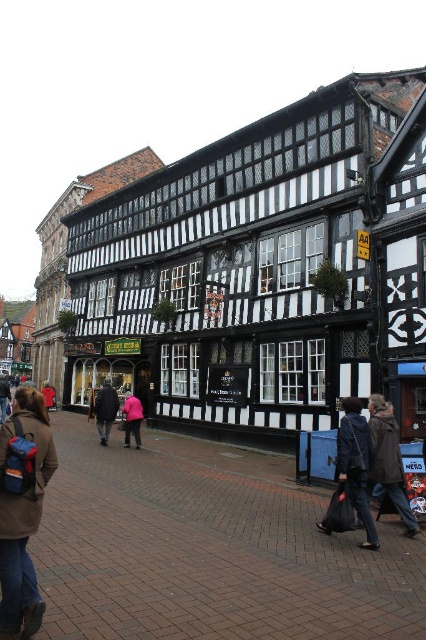
You are a customer looking for a jacket in a store. You see a brown fabric jacket at lower left and a red jacket at center. Which jacket is smaller?

The brown fabric jacket at lower left is smaller than the red jacket at center.

You are a delivery person who needs to place a package between the brown fabric jacket at lower left and the dark brown fur coat at center. The package requires a space of 2 meters. Can you fit it there?

The distance between the brown fabric jacket at lower left and the dark brown fur coat at center is 23.53 meters, so yes, the package requiring 2 meters of space can easily fit between them.